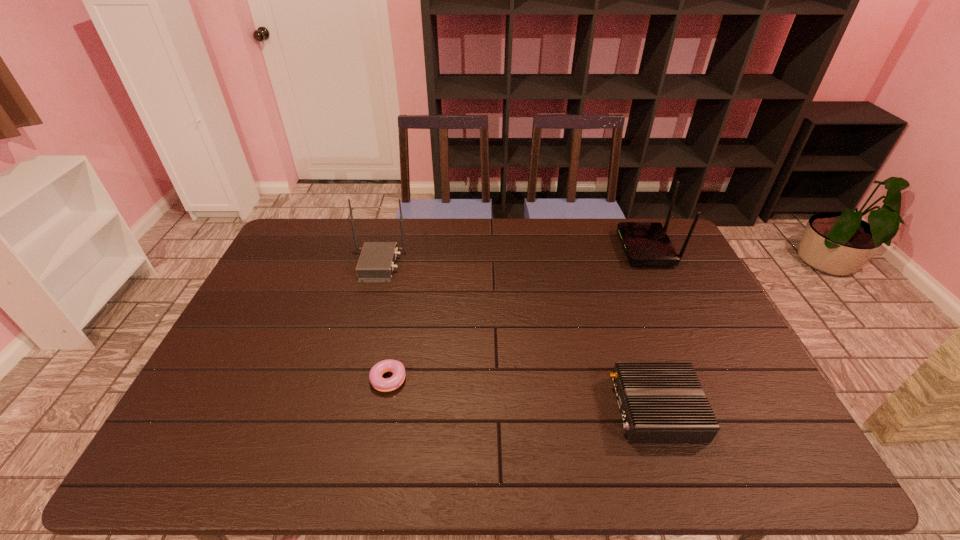
Find the location of a particular element. This screenshot has width=960, height=540. the leftmost router is located at coordinates (376, 263).

Identify the location of the third tallest object. The width and height of the screenshot is (960, 540). (660, 402).

The image size is (960, 540). In order to click on the shortest router in this screenshot , I will do `click(660, 402)`.

Identify the location of the shortest object. This screenshot has width=960, height=540. pos(396,367).

I want to click on free space located on the back of the leftmost router to connect cables, so click(434, 265).

The height and width of the screenshot is (540, 960). Identify the location of vacant space positioned on the back panel of the shortest router. (468, 409).

The height and width of the screenshot is (540, 960). I want to click on free space located on the back panel of the shortest router, so click(x=557, y=409).

Identify the location of vacant position located 0.250m on the back panel of the shortest router. (513, 409).

You are a GUI agent. You are given a task and a screenshot of the screen. Output one action in this format:
    pyautogui.click(x=<x>, y=<y>)
    Task: Click on the free space located 0.160m on the right of the shortest object
    
    Given the screenshot: What is the action you would take?
    pyautogui.click(x=467, y=383)

You are a GUI agent. You are given a task and a screenshot of the screen. Output one action in this format:
    pyautogui.click(x=<x>, y=<y>)
    Task: Click on the object that is at the near edge
    This screenshot has width=960, height=540.
    Given the screenshot: What is the action you would take?
    pyautogui.click(x=660, y=402)